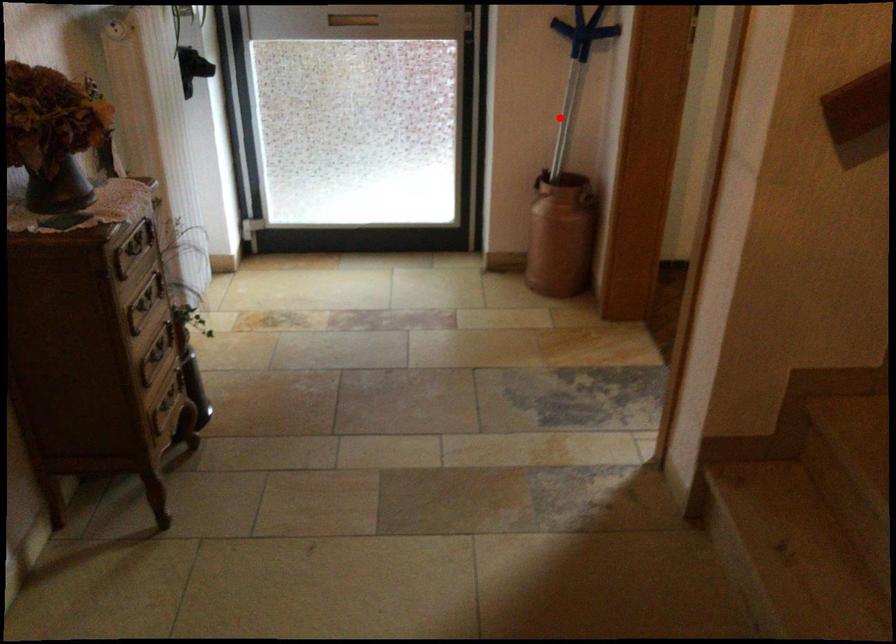
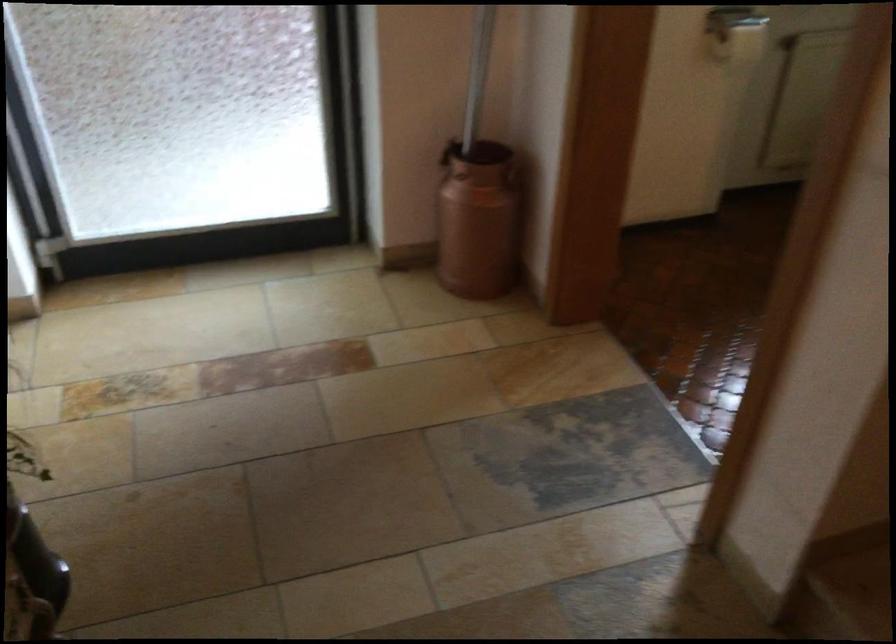
Question: I am providing you with two images of the same scene from different viewpoints. Given a red point in image1, look at the same physical point in image2. Is it:

Choices:
 (A) Closer to the viewpoint
 (B) Farther from the viewpoint

Answer: (A)